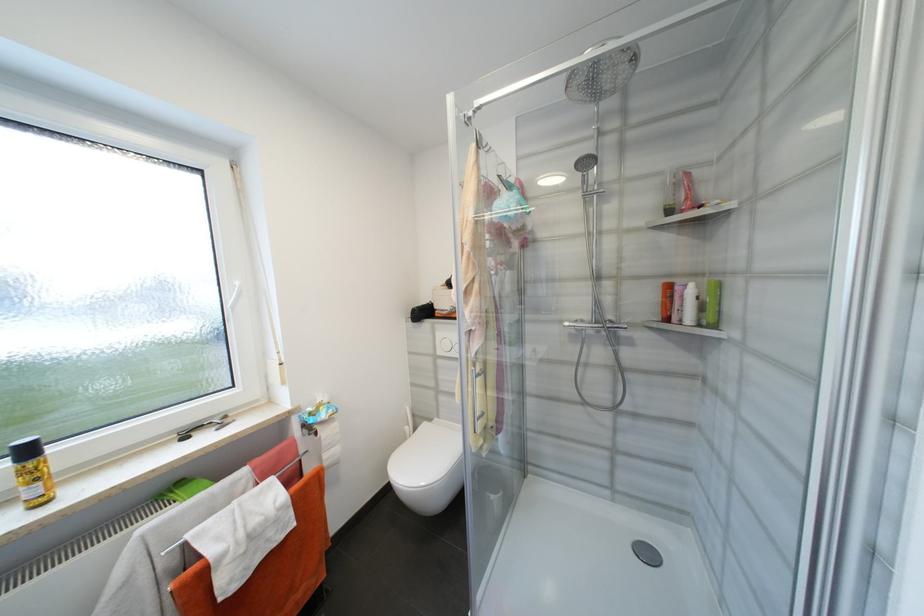
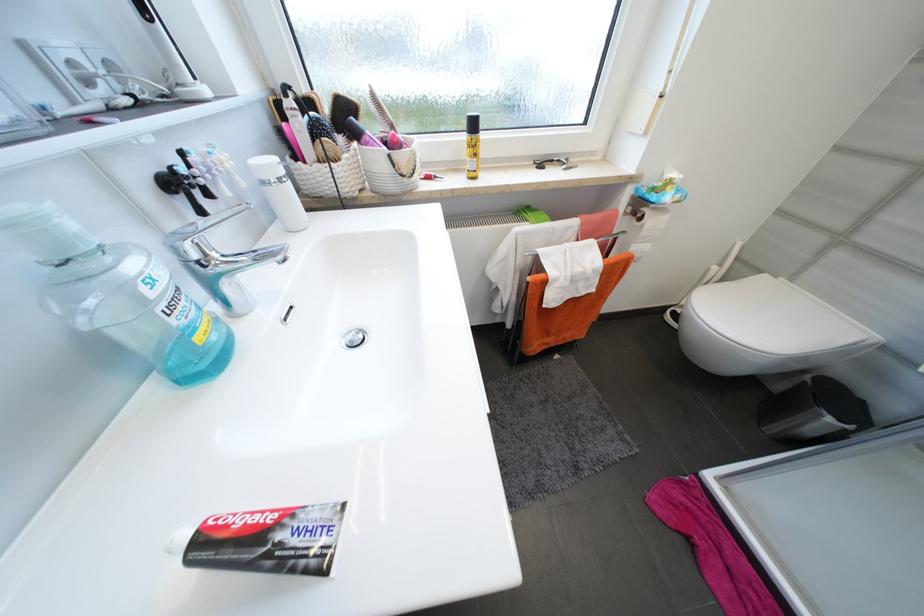
Looking at this image, the images are taken continuously from a first-person perspective. In which direction is your viewpoint rotating?

The rotation direction of the camera is left-down.